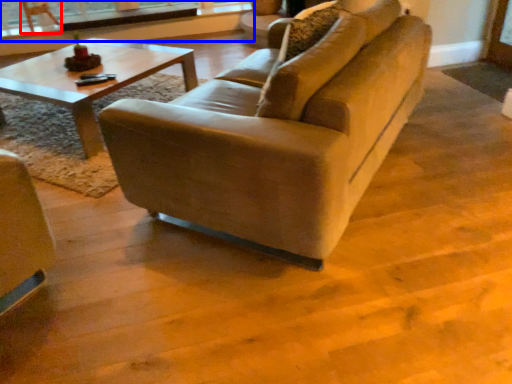
Question: Which of the following is the closest to the observer, armchair (highlighted by a red box) or window frame (highlighted by a blue box)?

Choices:
 (A) armchair
 (B) window frame

Answer: (A)